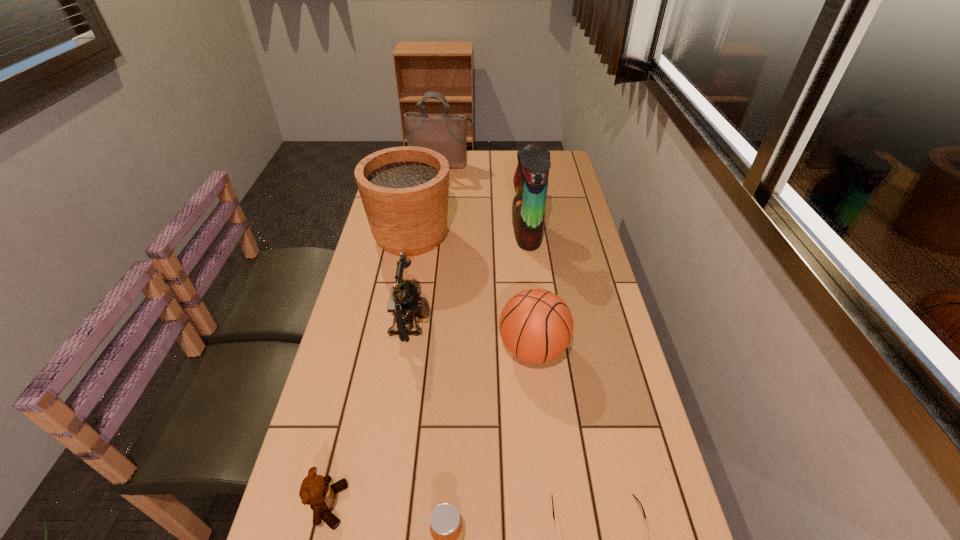
The height and width of the screenshot is (540, 960). I want to click on object that stands as the fifth closest to the telephone, so click(446, 531).

Where is `free region that satisfies the following two spatial constraints: 1. on the front-facing side of the farthest object; 2. on the left side of the basketball`? This screenshot has width=960, height=540. free region that satisfies the following two spatial constraints: 1. on the front-facing side of the farthest object; 2. on the left side of the basketball is located at coordinates (418, 349).

The width and height of the screenshot is (960, 540). What are the coordinates of `vacant space that satisfies the following two spatial constraints: 1. on the front-facing side of the farthest object; 2. on the left side of the basketball` in the screenshot? It's located at (418, 349).

This screenshot has width=960, height=540. Identify the location of free space in the image that satisfies the following two spatial constraints: 1. at the face of the parrot; 2. on the front side of the basketball. (541, 349).